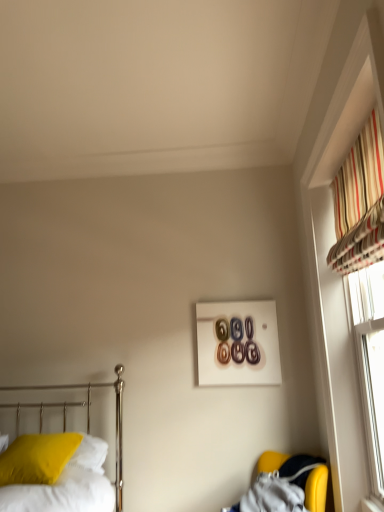
Question: From a real-world perspective, is metallic bed at left located higher than matte yellow pillow at lower left?

Choices:
 (A) yes
 (B) no

Answer: (A)

Question: From a real-world perspective, is metallic bed at left beneath matte yellow pillow at lower left?

Choices:
 (A) no
 (B) yes

Answer: (A)

Question: Considering the relative sizes of metallic bed at left and matte yellow pillow at lower left in the image provided, is metallic bed at left shorter than matte yellow pillow at lower left?

Choices:
 (A) no
 (B) yes

Answer: (A)

Question: From the image's perspective, does metallic bed at left appear lower than matte yellow pillow at lower left?

Choices:
 (A) yes
 (B) no

Answer: (B)

Question: Is the position of metallic bed at left more distant than that of matte yellow pillow at lower left?

Choices:
 (A) no
 (B) yes

Answer: (A)

Question: Is metallic bed at left not close to matte yellow pillow at lower left?

Choices:
 (A) yes
 (B) no

Answer: (B)

Question: From the image's perspective, is yellow fabric armchair at lower right below striped fabric at upper right?

Choices:
 (A) yes
 (B) no

Answer: (A)

Question: Does yellow fabric armchair at lower right have a greater height compared to striped fabric at upper right?

Choices:
 (A) yes
 (B) no

Answer: (B)

Question: Is yellow fabric armchair at lower right positioned beyond the bounds of striped fabric at upper right?

Choices:
 (A) yes
 (B) no

Answer: (A)

Question: From a real-world perspective, is yellow fabric armchair at lower right below striped fabric at upper right?

Choices:
 (A) no
 (B) yes

Answer: (B)

Question: Are yellow fabric armchair at lower right and striped fabric at upper right located far from each other?

Choices:
 (A) yes
 (B) no

Answer: (A)

Question: From a real-world perspective, is yellow fabric armchair at lower right on striped fabric at upper right?

Choices:
 (A) yes
 (B) no

Answer: (B)

Question: From a real-world perspective, is yellow fabric armchair at lower right over matte yellow pillow at lower left?

Choices:
 (A) yes
 (B) no

Answer: (B)